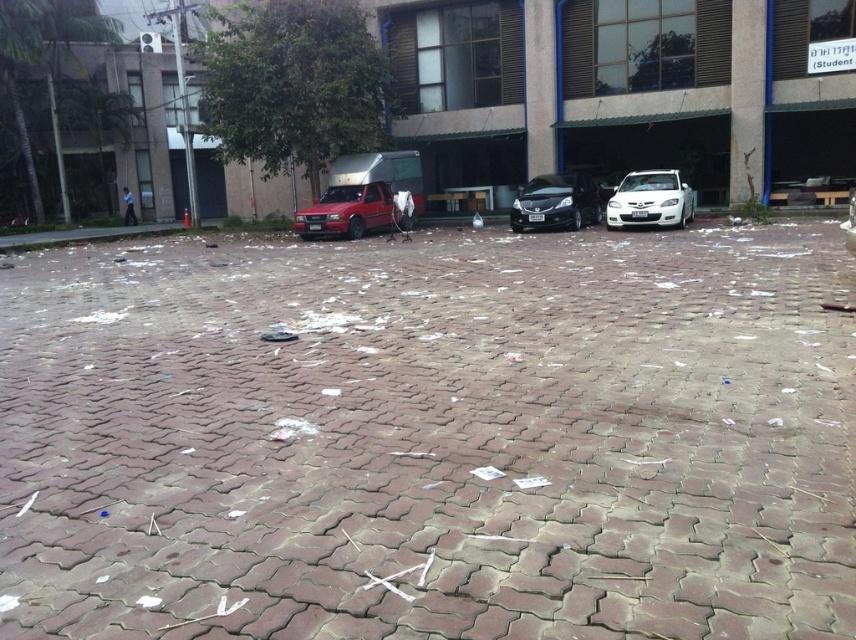
You are standing at the origin point of the coordinate system. You want to walk to the brick pavement at center. What coordinates should you walk towards?

You should walk towards the coordinates point at (431, 438) to reach the brick pavement at center.

You are standing in the outdoor scene and want to walk from the brick pavement at center to the white glossy car at center. Which direction should you move to get closer to the car?

Since the brick pavement at center is closer to the viewer than the white glossy car at center, you should move backward to get closer to the white glossy car at center.

You are a delivery person who needs to park your vehicle in a space that is 1.8 meters tall. You see the matte red truck at center and the white glossy car at center. Which vehicle can fit in the space based on their heights?

The white glossy car at center can fit in the parking space since it is shorter than the matte red truck at center, and the space is 1.8 meters tall.